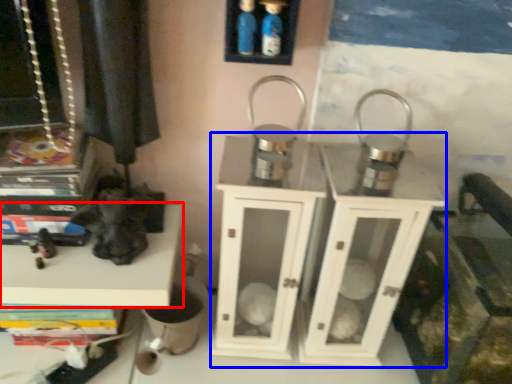
Question: Which object is further to the camera taking this photo, shelf (highlighted by a red box) or dresser (highlighted by a blue box)?

Choices:
 (A) shelf
 (B) dresser

Answer: (A)